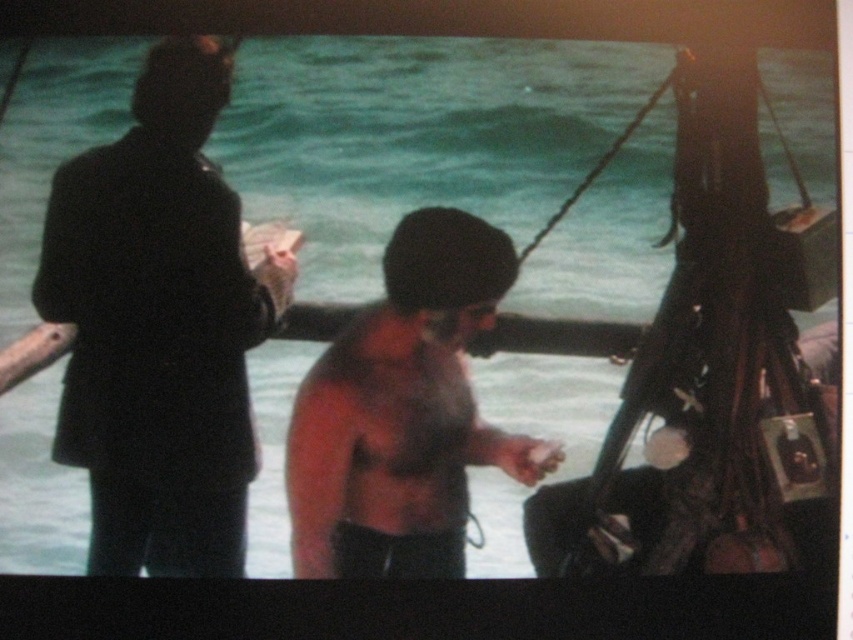
Which is in front, point (175, 227) or point (531, 483)?

Point (175, 227)

Which of these two, black matte suit at left or shiny skin torso at center, stands shorter?

shiny skin torso at center

This screenshot has width=853, height=640. What are the coordinates of `black matte suit at left` in the screenshot? It's located at (160, 326).